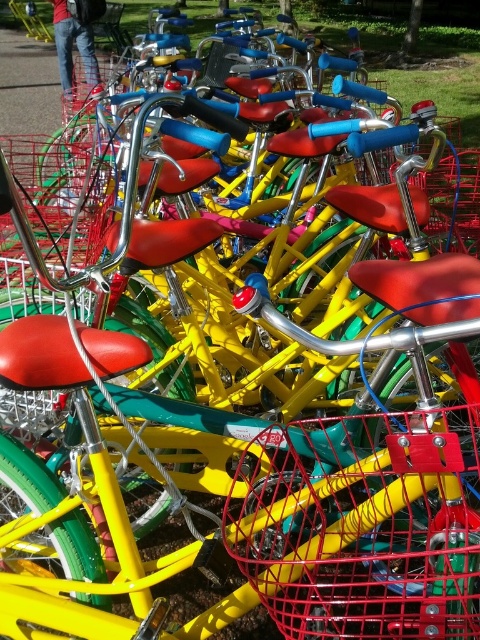
In the scene shown: Between red wire basket at center and metallic wire basket at lower left, which one is positioned higher?

metallic wire basket at lower left

Describe the element at coordinates (362, 525) in the screenshot. I see `red wire basket at center` at that location.

At what (x,y) coordinates should I click in order to perform the action: click on red wire basket at center. Please return your answer as a coordinate pair (x, y). The height and width of the screenshot is (640, 480). Looking at the image, I should click on (362, 525).